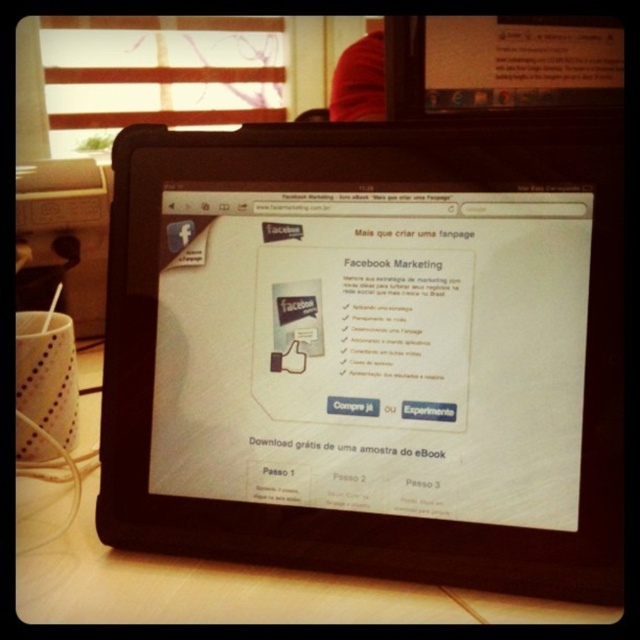
You are a photographer setting up a tripod to capture the black matte tablet at center. The tripod must be placed at point 0.5, 0.5 to ensure stability. Will the tripod interfere with the tablet?

The black matte tablet at center is positioned at point (x=362, y=340), which is slightly to the right and above the tripod placement at (x=320, y=320). Therefore, the tripod will not interfere with the tablet.

You are a photographer setting up a shot of the black matte tablet at center and the wooden table at lower center. To ensure both objects are in focus, where should you position your camera relative to the tablet?

The black matte tablet at center is located above the wooden table at lower center, so positioning the camera slightly above the tablet will ensure both objects are in focus.

You are a delivery robot with a package that is 5 inches wide. You need to place it on the wooden table at lower center next to the black matte tablet at center. Is there enough space between them to fit your package?

The distance between the black matte tablet at center and the wooden table at lower center is 4.50 inches. Since your package is 5 inches wide, it won not fit as the space is slightly narrower than the package.